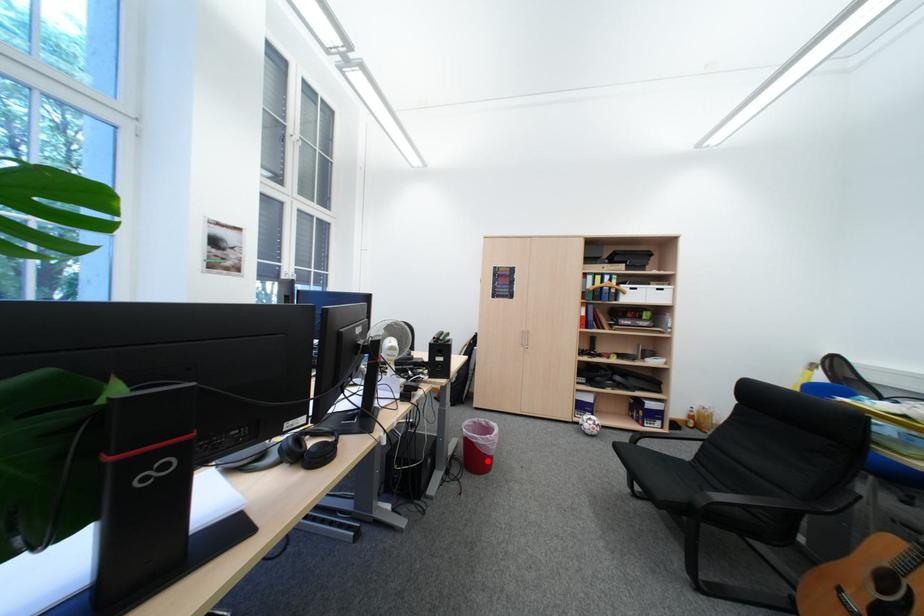
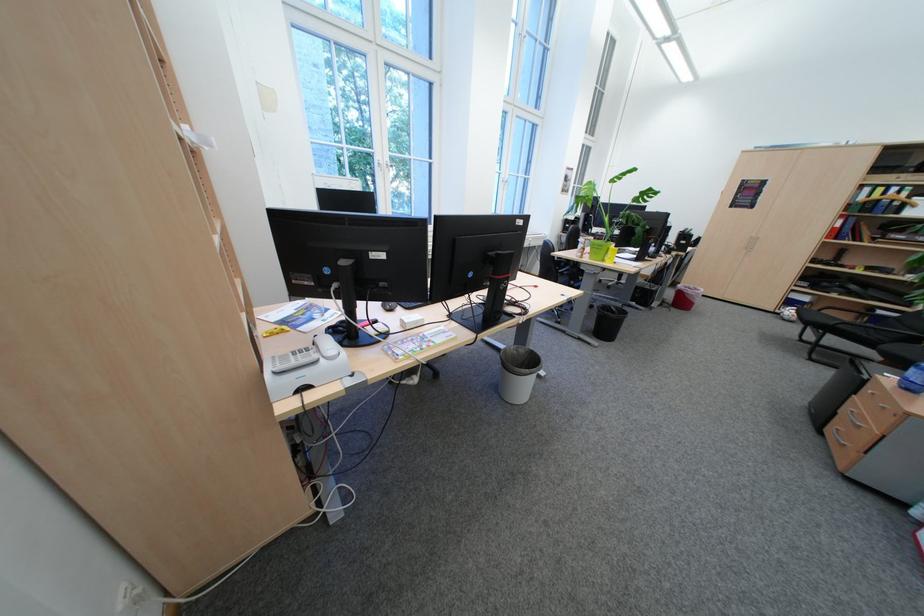
Question: I am providing you with two images of the same scene from different viewpoints. Given a red point in image1, look at the same physical point in image2. Is it:

Choices:
 (A) Closer to the viewpoint
 (B) Farther from the viewpoint

Answer: (A)